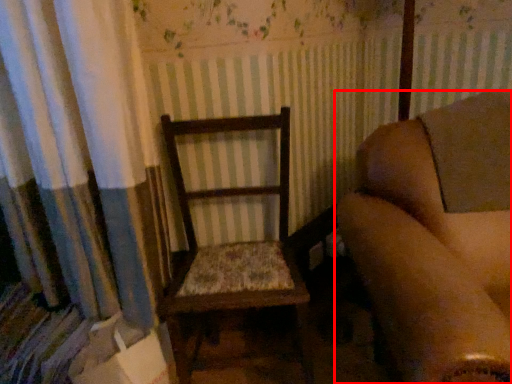
Question: From the image's perspective, what is the correct spatial positioning of chair (annotated by the red box) in reference to rocking chair?

Choices:
 (A) below
 (B) above

Answer: (A)